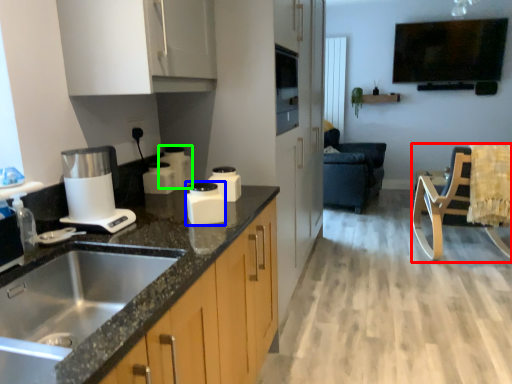
Question: Which object is positioned farthest from rocking chair (highlighted by a red box)? Select from kitchen appliance (highlighted by a blue box) and kitchen appliance (highlighted by a green box).

Choices:
 (A) kitchen appliance
 (B) kitchen appliance

Answer: (A)